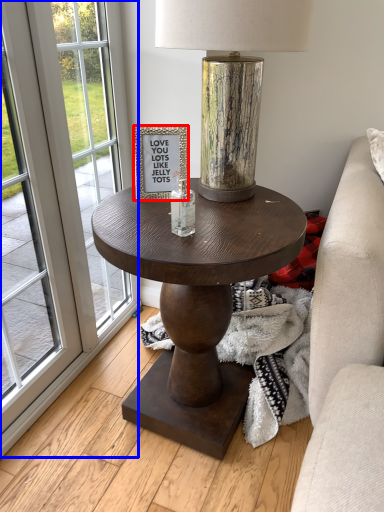
Question: Which object is further to the camera taking this photo, picture frame (highlighted by a red box) or screen door (highlighted by a blue box)?

Choices:
 (A) picture frame
 (B) screen door

Answer: (A)